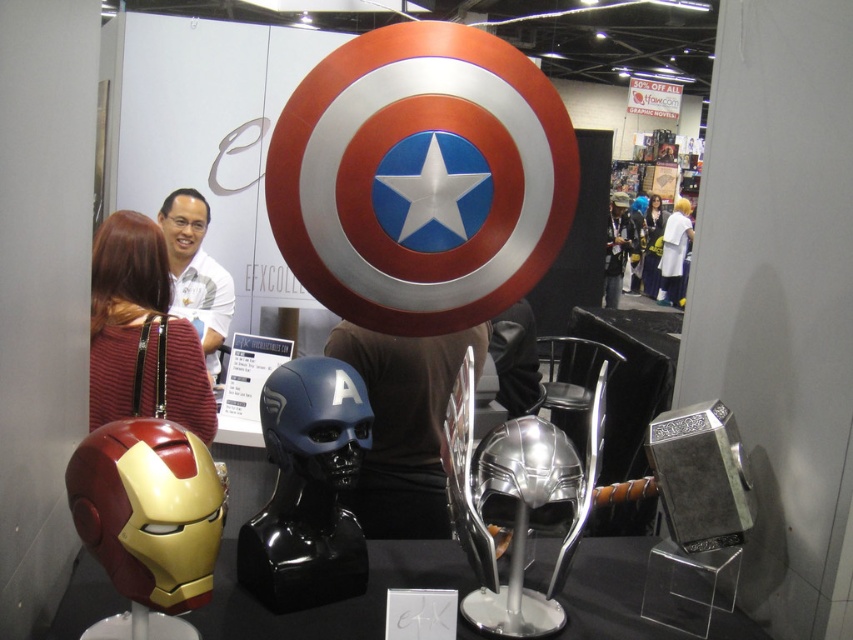
Who is positioned more to the right, glossy blue helmet at center or maroon striped sweater at left?

Positioned to the right is glossy blue helmet at center.

Can you confirm if glossy blue helmet at center is wider than maroon striped sweater at left?

Incorrect, glossy blue helmet at center's width does not surpass maroon striped sweater at left's.

The image size is (853, 640). In order to click on glossy blue helmet at center in this screenshot , I will do `click(308, 488)`.

Locate an element on the screen. glossy blue helmet at center is located at coordinates tap(308, 488).

Is point (281, 502) in front of point (680, 198)?

Yes.

What do you see at coordinates (308, 488) in the screenshot? The image size is (853, 640). I see `glossy blue helmet at center` at bounding box center [308, 488].

The height and width of the screenshot is (640, 853). What do you see at coordinates (308, 488) in the screenshot? I see `glossy blue helmet at center` at bounding box center [308, 488].

I want to click on glossy blue helmet at center, so click(308, 488).

Who is more forward, (177,376) or (660,227)?

Point (177,376) is in front.

Who is lower down, maroon striped sweater at left or silky black hair at upper center?

maroon striped sweater at left

Who is more distant from viewer, (94, 248) or (660, 228)?

The point (660, 228) is behind.

Where is `maroon striped sweater at left`? The height and width of the screenshot is (640, 853). maroon striped sweater at left is located at coordinates (140, 326).